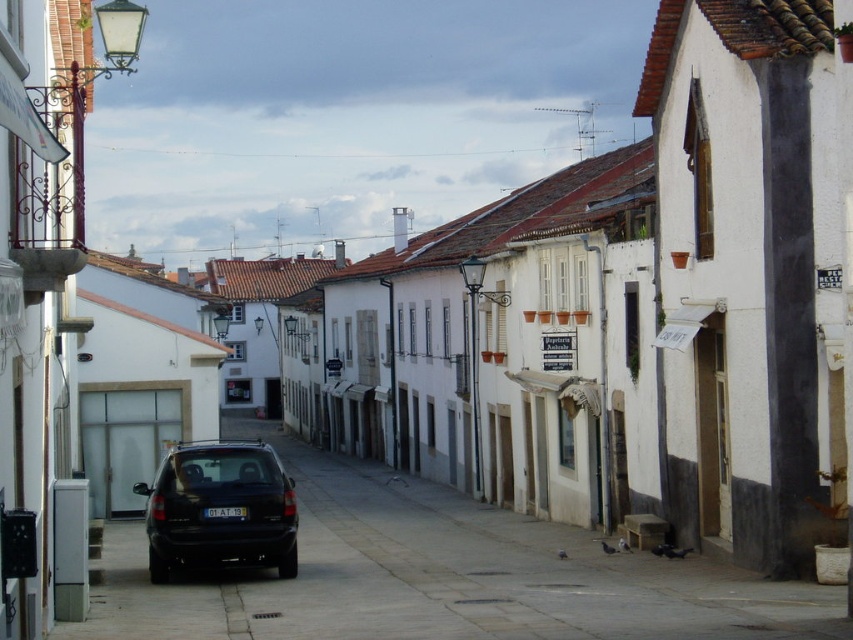
Question: Is black matte car at center to the left of matte black car at center from the viewer's perspective?

Choices:
 (A) no
 (B) yes

Answer: (A)

Question: Does black matte car at center appear on the left side of matte black car at center?

Choices:
 (A) yes
 (B) no

Answer: (B)

Question: Does black matte car at center appear on the right side of matte black car at center?

Choices:
 (A) no
 (B) yes

Answer: (B)

Question: Which object is farther from the camera taking this photo?

Choices:
 (A) matte black car at center
 (B) black matte car at center

Answer: (A)